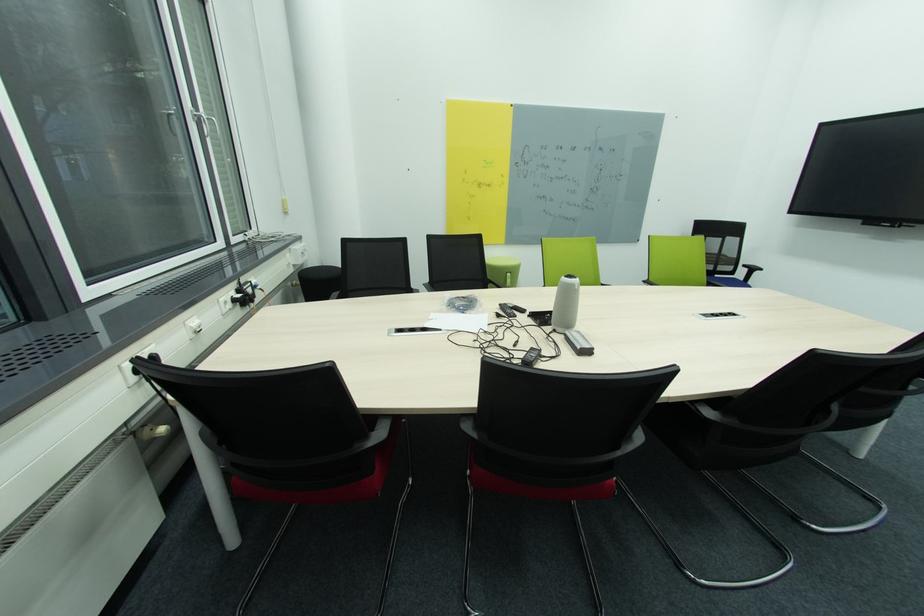
Where is `black chair armrest`? Image resolution: width=924 pixels, height=616 pixels. black chair armrest is located at coordinates (375, 419).